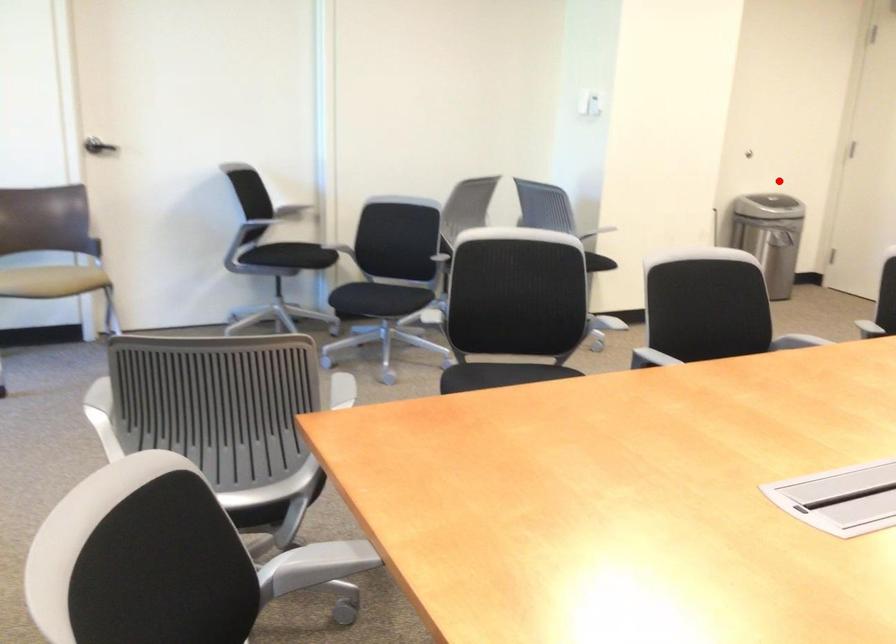
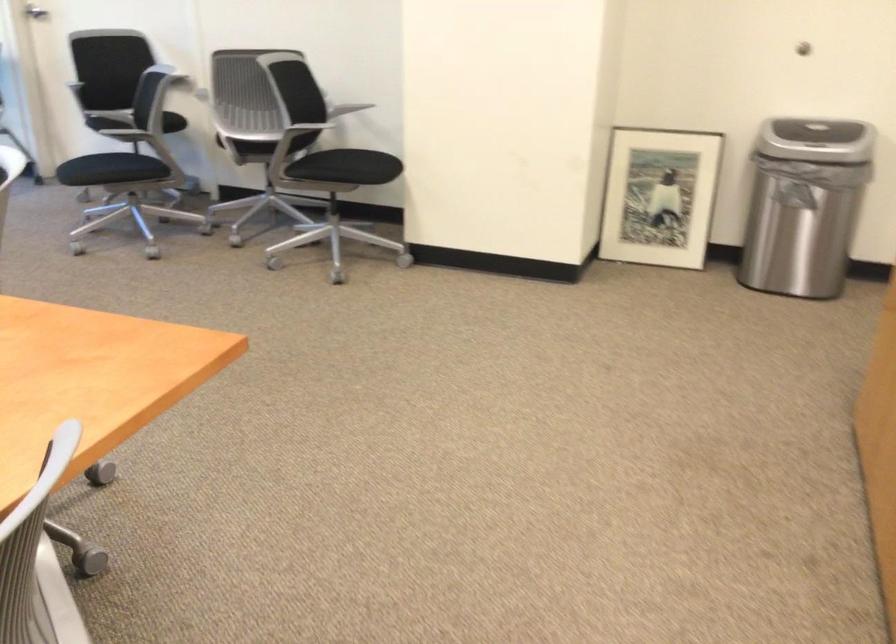
Question: I am providing you with two images of the same scene from different viewpoints. A red point is shown in image1. For the corresponding object point in image2, is it positioned nearer or farther from the camera?

Choices:
 (A) Nearer
 (B) Farther

Answer: (A)